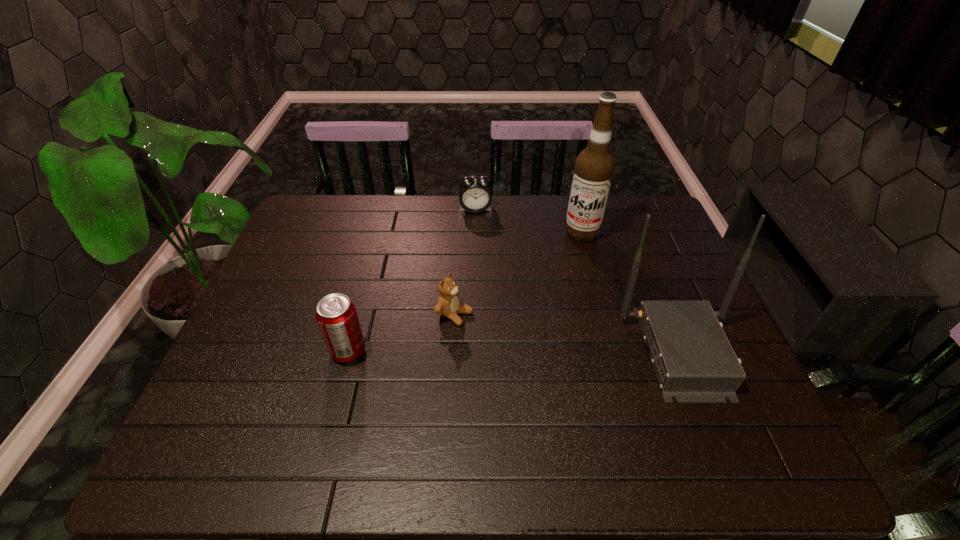
Identify the location of object that is at the right edge. (693, 360).

I want to click on object positioned at the near right corner, so click(693, 360).

At what (x,y) coordinates should I click in order to perform the action: click on free space at the far edge of the desktop. Please return your answer as a coordinate pair (x, y). The width and height of the screenshot is (960, 540). Looking at the image, I should click on (417, 195).

You are a GUI agent. You are given a task and a screenshot of the screen. Output one action in this format:
    pyautogui.click(x=<x>, y=<y>)
    Task: Click on the vacant space at the near edge
    This screenshot has height=540, width=960.
    Given the screenshot: What is the action you would take?
    pyautogui.click(x=637, y=393)

This screenshot has height=540, width=960. What are the coordinates of `free space at the left edge` in the screenshot? It's located at (293, 347).

The height and width of the screenshot is (540, 960). Find the location of `free space at the right edge`. free space at the right edge is located at coordinates (630, 257).

This screenshot has width=960, height=540. I want to click on free space at the far left corner, so click(332, 205).

Image resolution: width=960 pixels, height=540 pixels. In the image, there is a desktop. Identify the location of free region at the far right corner. (636, 224).

At what (x,y) coordinates should I click in order to perform the action: click on vacant space that's between the teddy bear and the fourth shortest object. Please return your answer as a coordinate pair (x, y). Image resolution: width=960 pixels, height=540 pixels. Looking at the image, I should click on (568, 332).

Image resolution: width=960 pixels, height=540 pixels. I want to click on vacant area between the soda and the farthest object, so click(412, 280).